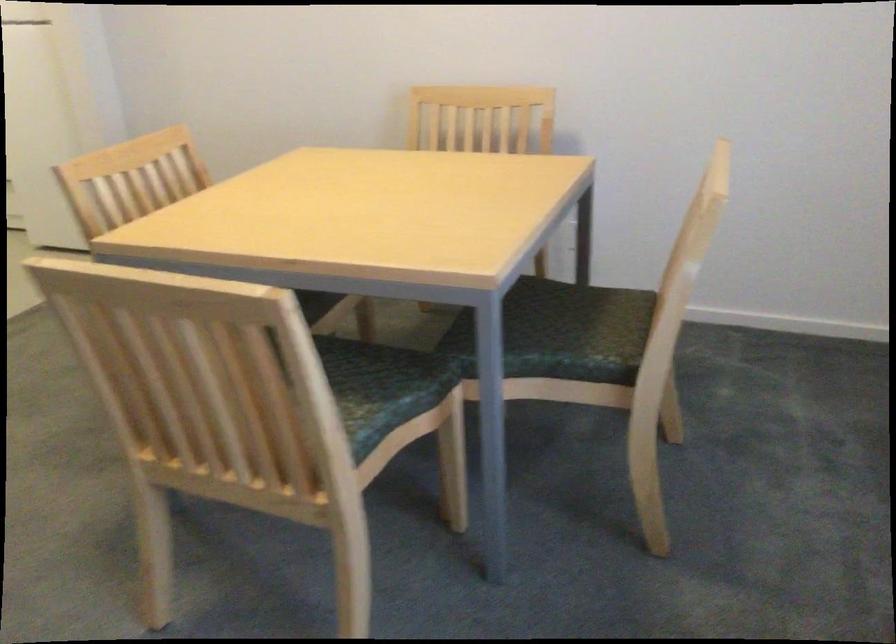
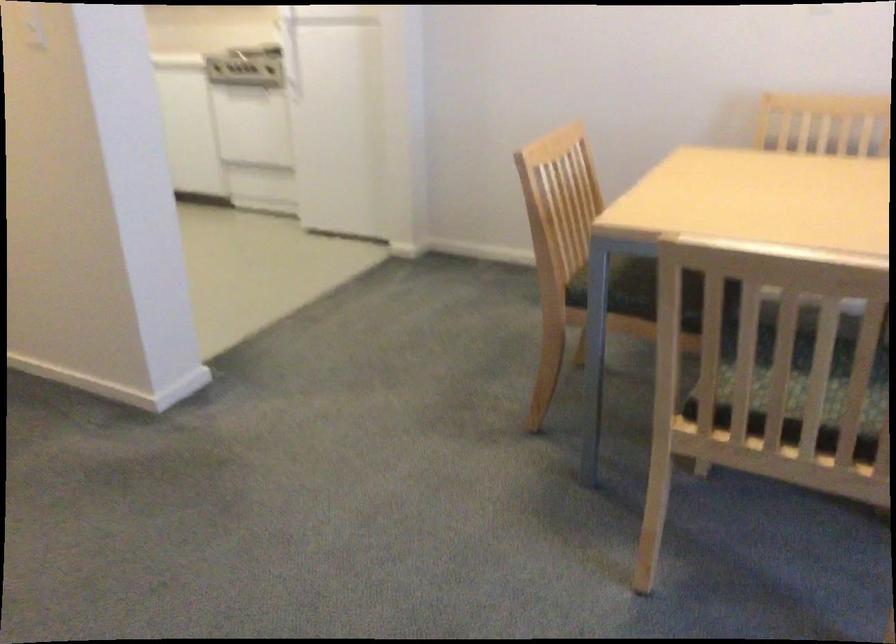
Question: In a continuous first-person perspective shot, in which direction is the camera moving?

Choices:
 (A) Left
 (B) Right
 (C) Forward
 (D) Backward

Answer: (A)